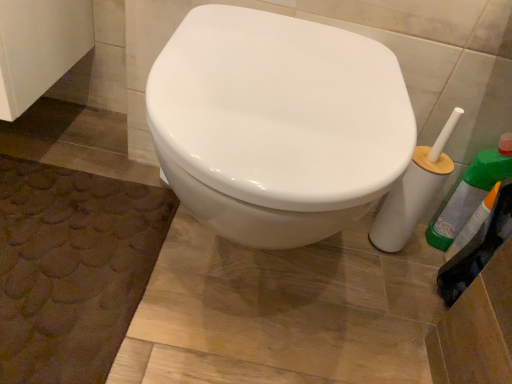
Find the location of a particular element. brown textured bath mat at lower left is located at coordinates (72, 268).

Image resolution: width=512 pixels, height=384 pixels. What do you see at coordinates (72, 268) in the screenshot? I see `brown textured bath mat at lower left` at bounding box center [72, 268].

In order to face green plastic bottle at right, should I rotate leftwards or rightwards?

Rotate right and turn 27.357 degrees.

Describe the element at coordinates (470, 192) in the screenshot. I see `green plastic bottle at right` at that location.

Consider the image. What is the approximate height of green plastic bottle at right?

12.71 inches.

The height and width of the screenshot is (384, 512). I want to click on green plastic bottle at right, so click(x=470, y=192).

This screenshot has height=384, width=512. In order to click on brown textured bath mat at lower left in this screenshot , I will do `click(72, 268)`.

Which object is positioned more to the right, brown textured bath mat at lower left or green plastic bottle at right?

From the viewer's perspective, green plastic bottle at right appears more on the right side.

Between brown textured bath mat at lower left and green plastic bottle at right, which one is positioned behind?

Positioned behind is green plastic bottle at right.

Is point (5, 232) positioned before point (451, 239)?

Yes, it is in front of point (451, 239).

From the image's perspective, is brown textured bath mat at lower left located beneath green plastic bottle at right?

Yes, from the image's perspective, brown textured bath mat at lower left is below green plastic bottle at right.

From a real-world perspective, does brown textured bath mat at lower left stand above green plastic bottle at right?

No.

Which of these two, brown textured bath mat at lower left or green plastic bottle at right, is thinner?

green plastic bottle at right.

In the scene shown: Is brown textured bath mat at lower left shorter than green plastic bottle at right?

Yes, brown textured bath mat at lower left is shorter than green plastic bottle at right.

In the scene shown: Who is bigger, brown textured bath mat at lower left or green plastic bottle at right?

With larger size is brown textured bath mat at lower left.

Do you think brown textured bath mat at lower left is within green plastic bottle at right, or outside of it?

brown textured bath mat at lower left lies outside green plastic bottle at right.

Would you say brown textured bath mat at lower left is a long distance from green plastic bottle at right?

No, there isn't a large distance between brown textured bath mat at lower left and green plastic bottle at right.

Is brown textured bath mat at lower left oriented towards green plastic bottle at right?

No, brown textured bath mat at lower left does not turn towards green plastic bottle at right.

How different are the orientations of brown textured bath mat at lower left and green plastic bottle at right in degrees?

The angular difference between brown textured bath mat at lower left and green plastic bottle at right is 88.9 degrees.

The image size is (512, 384). Identify the location of bath mat below the green plastic bottle at right (from the image's perspective). (72, 268).

Considering the relative positions of green plastic bottle at right and brown textured bath mat at lower left in the image provided, is green plastic bottle at right to the left or to the right of brown textured bath mat at lower left?

From the image, it's evident that green plastic bottle at right is to the right of brown textured bath mat at lower left.

Which is in front, green plastic bottle at right or brown textured bath mat at lower left?

Positioned in front is brown textured bath mat at lower left.

Is point (452, 233) closer to viewer compared to point (62, 323)?

That is False.

Consider the image. From the image's perspective, between green plastic bottle at right and brown textured bath mat at lower left, who is located below?

brown textured bath mat at lower left.

From a real-world perspective, is green plastic bottle at right on brown textured bath mat at lower left?

Indeed, from a real-world perspective, green plastic bottle at right stands above brown textured bath mat at lower left.

Which of these two, green plastic bottle at right or brown textured bath mat at lower left, is wider?

brown textured bath mat at lower left.

From their relative heights in the image, would you say green plastic bottle at right is taller or shorter than brown textured bath mat at lower left?

In the image, green plastic bottle at right appears to be taller than brown textured bath mat at lower left.

Based on the photo, does green plastic bottle at right have a larger size compared to brown textured bath mat at lower left?

No, green plastic bottle at right is not bigger than brown textured bath mat at lower left.

Is green plastic bottle at right outside of brown textured bath mat at lower left?

Indeed, green plastic bottle at right is completely outside brown textured bath mat at lower left.

Are green plastic bottle at right and brown textured bath mat at lower left far apart?

No, green plastic bottle at right is not far from brown textured bath mat at lower left.

Is green plastic bottle at right aimed at brown textured bath mat at lower left?

No.

Can you tell me how much green plastic bottle at right and brown textured bath mat at lower left differ in facing direction?

The angular difference between green plastic bottle at right and brown textured bath mat at lower left is 88.9 degrees.

From the picture: Measure the distance from green plastic bottle at right to brown textured bath mat at lower left.

A distance of 31.13 inches exists between green plastic bottle at right and brown textured bath mat at lower left.

This screenshot has height=384, width=512. I want to click on bath mat that appears on the left of green plastic bottle at right, so click(x=72, y=268).

The width and height of the screenshot is (512, 384). Identify the location of bath mat in front of the green plastic bottle at right. (x=72, y=268).

Where is `cleaning product above the brown textured bath mat at lower left (from a real-world perspective)`? The image size is (512, 384). cleaning product above the brown textured bath mat at lower left (from a real-world perspective) is located at coordinates [x=470, y=192].